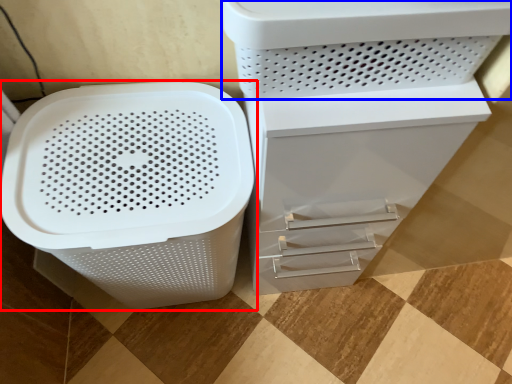
Question: Which object appears closest to the camera in this image, waste container (highlighted by a red box) or appliance (highlighted by a blue box)?

Choices:
 (A) waste container
 (B) appliance

Answer: (B)